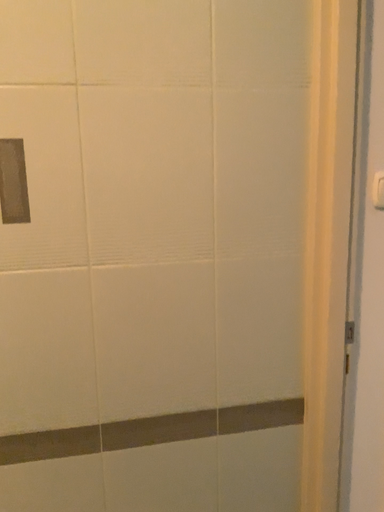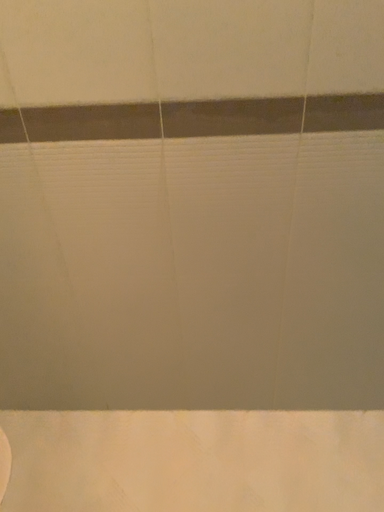
Question: How did the camera likely rotate when shooting the video?

Choices:
 (A) rotated upward
 (B) rotated downward

Answer: (B)